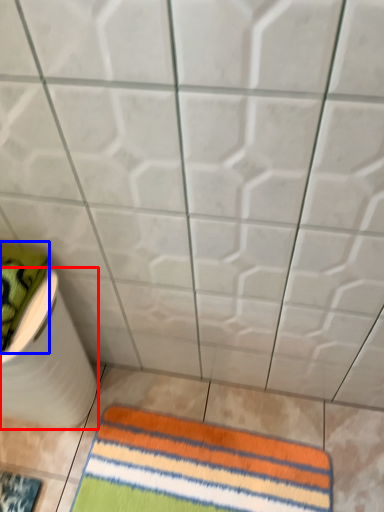
Question: Which of the following is the farthest to the observer, toilet paper (highlighted by a red box) or beach towel (highlighted by a blue box)?

Choices:
 (A) toilet paper
 (B) beach towel

Answer: (A)